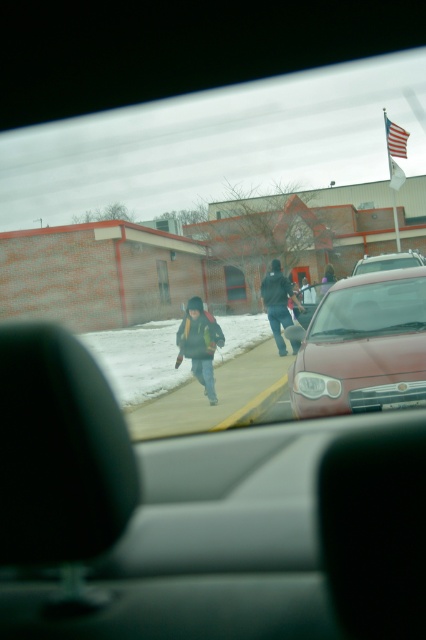
You are sitting in the car and want to see the child walking on the sidewalk through the clear glass windshield at center. Is the child visible through the windshield?

The clear glass windshield at center is located at point (371, 308), which would allow the child walking on the sidewalk to be visible through it since the windshield is clear and positioned centrally in the car.

You are a passenger in the car and want to know if you can see the child walking on the smooth concrete sidewalk at center through the clear glass windshield at center. Based on their widths, can you determine if the entire sidewalk fits within the windshield view?

The smooth concrete sidewalk at center is wider than the clear glass windshield at center, so the entire sidewalk cannot fit within the windshield view.

You are a passenger in the car and want to see the child clearly. Which object, the smooth concrete sidewalk at center or the clear glass windshield at center, would allow you to see the child more clearly?

The clear glass windshield at center allows for clearer visibility of the child since it is designed for viewing outside, whereas the smooth concrete sidewalk at center is part of the ground and not a viewing surface.